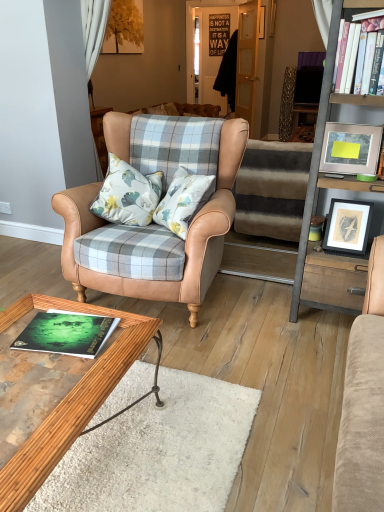
Where is `wooden framed print at right, the 1th picture frame ordered from the bottom`? The height and width of the screenshot is (512, 384). wooden framed print at right, the 1th picture frame ordered from the bottom is located at coordinates (347, 227).

Identify the location of wooden polished coffee table at lower left. (68, 398).

Describe the element at coordinates (272, 189) in the screenshot. I see `striped carpet at center` at that location.

Find the location of a particular element. This screenshot has height=512, width=384. matte white picture frame at upper right, which is the second picture frame from bottom to top is located at coordinates (350, 149).

This screenshot has width=384, height=512. Find the location of `metallic gray ladder at right`. metallic gray ladder at right is located at coordinates (317, 180).

This screenshot has width=384, height=512. In order to click on green matte book at lower left, the first book positioned from the bottom in this screenshot , I will do `click(66, 333)`.

I want to click on leather armchair at center, so click(x=186, y=238).

Locate an element on the screen. This screenshot has height=512, width=384. wooden framed print at right, the 1th picture frame ordered from the bottom is located at coordinates (347, 227).

What's the angular difference between wooden framed print at right, the 1th picture frame ordered from the bottom, and leather armchair at center's facing directions?

There is a 1.22-degree angle between the facing directions of wooden framed print at right, the 1th picture frame ordered from the bottom, and leather armchair at center.

Looking at this image, can you see wooden framed print at right, the 1th picture frame ordered from the bottom, touching leather armchair at center?

No, wooden framed print at right, the 1th picture frame ordered from the bottom, is not touching leather armchair at center.

Between wooden framed print at right, which is counted as the second picture frame, starting from the top, and leather armchair at center, which one is positioned behind?

wooden framed print at right, which is counted as the second picture frame, starting from the top, is further from the camera.

Considering the relative sizes of wooden framed print at right, the 1th picture frame ordered from the bottom, and leather armchair at center in the image provided, is wooden framed print at right, the 1th picture frame ordered from the bottom, bigger than leather armchair at center?

Actually, wooden framed print at right, the 1th picture frame ordered from the bottom, might be smaller than leather armchair at center.

Is striped carpet at center facing away from white hardcover book at upper right, the first book viewed from the right?

No, striped carpet at center is not facing the opposite direction of white hardcover book at upper right, the first book viewed from the right.

Is striped carpet at center positioned in front of white hardcover book at upper right, which is the 1th book from top to bottom?

No, striped carpet at center is further to the viewer.

From a real-world perspective, is striped carpet at center below white hardcover book at upper right, which is the 1th book from top to bottom?

Yes, from a real-world perspective, striped carpet at center is beneath white hardcover book at upper right, which is the 1th book from top to bottom.

Does green matte book at lower left, the first book positioned from the bottom, have a greater width compared to metallic gray ladder at right?

No, green matte book at lower left, the first book positioned from the bottom, is not wider than metallic gray ladder at right.

Relative to metallic gray ladder at right, is green matte book at lower left, acting as the 1th book starting from the front, in front or behind?

Visually, green matte book at lower left, acting as the 1th book starting from the front, is located in front of metallic gray ladder at right.

From a real-world perspective, does green matte book at lower left, acting as the 1th book starting from the front, sit lower than metallic gray ladder at right?

Yes, from a real-world perspective, green matte book at lower left, acting as the 1th book starting from the front, is under metallic gray ladder at right.

From the image's perspective, which is below, green matte book at lower left, the second book when ordered from top to bottom, or metallic gray ladder at right?

green matte book at lower left, the second book when ordered from top to bottom, is shown below in the image.

Which of these two, metallic gray ladder at right or wooden polished coffee table at lower left, stands taller?

metallic gray ladder at right.

Which object is positioned more to the left, metallic gray ladder at right or wooden polished coffee table at lower left?

wooden polished coffee table at lower left.

Based on the photo, which is in front, metallic gray ladder at right or wooden polished coffee table at lower left?

wooden polished coffee table at lower left.

Based on the photo, are metallic gray ladder at right and wooden polished coffee table at lower left located far from each other?

Yes, metallic gray ladder at right is far from wooden polished coffee table at lower left.

Is white hardcover book at upper right, which is the 1th book from top to bottom, not inside wooden framed print at right, the 1th picture frame ordered from the bottom?

Indeed, white hardcover book at upper right, which is the 1th book from top to bottom, is completely outside wooden framed print at right, the 1th picture frame ordered from the bottom.

Is white hardcover book at upper right, which is the 1th book from top to bottom, facing away from wooden framed print at right, the 1th picture frame ordered from the bottom?

No.

Which point is more forward, (342, 32) or (372, 207)?

The point (342, 32) is more forward.

Which object is closer to the camera taking this photo, white hardcover book at upper right, marked as the 2th book in a front-to-back arrangement, or wooden framed print at right, which is counted as the second picture frame, starting from the top?

white hardcover book at upper right, marked as the 2th book in a front-to-back arrangement, is more forward.

From a real-world perspective, who is located higher, leather armchair at center or metallic gray ladder at right?

In real-world perspective, metallic gray ladder at right is above.

In the scene shown: Is metallic gray ladder at right located within leather armchair at center?

No, leather armchair at center does not contain metallic gray ladder at right.

Which of these two, leather armchair at center or metallic gray ladder at right, is smaller?

Smaller between the two is metallic gray ladder at right.

Is leather armchair at center oriented towards metallic gray ladder at right?

No, leather armchair at center does not turn towards metallic gray ladder at right.

Looking at this image, are striped carpet at center and green matte book at lower left, acting as the 1th book starting from the front, far apart?

Yes, striped carpet at center and green matte book at lower left, acting as the 1th book starting from the front, are located far from each other.

From the picture: Is striped carpet at center inside or outside of green matte book at lower left, which is the second book from back to front?

striped carpet at center exists outside the volume of green matte book at lower left, which is the second book from back to front.

From the image's perspective, is striped carpet at center below green matte book at lower left, the 2th book when ordered from right to left?

No.

From the picture: Which object is thinner, striped carpet at center or green matte book at lower left, acting as the 1th book starting from the front?

green matte book at lower left, acting as the 1th book starting from the front, is thinner.

At what (x,y) coordinates should I click in order to perform the action: click on picture frame located below the leather armchair at center (from the image's perspective). Please return your answer as a coordinate pair (x, y). Image resolution: width=384 pixels, height=512 pixels. Looking at the image, I should click on (347, 227).

Identify the location of book above the striped carpet at center (from the image's perspective). (353, 47).

Considering their positions, is metallic gray ladder at right positioned closer to white hardcover book at upper right, which is the 1th book from top to bottom, than striped carpet at center?

The object closer to white hardcover book at upper right, which is the 1th book from top to bottom, is metallic gray ladder at right.

From the image, which object appears to be farther from matte white picture frame at upper right, placed as the 1th picture frame when sorted from top to bottom, striped carpet at center or metallic gray ladder at right?

striped carpet at center is positioned further to the anchor matte white picture frame at upper right, placed as the 1th picture frame when sorted from top to bottom.

Which object lies nearer to the anchor point matte white picture frame at upper right, which is the second picture frame from bottom to top, leather armchair at center or wooden polished coffee table at lower left?

leather armchair at center is closer to matte white picture frame at upper right, which is the second picture frame from bottom to top.

From the picture: Considering their positions, is metallic gray ladder at right positioned closer to matte white picture frame at upper right, which is the second picture frame from bottom to top, than striped carpet at center?

Based on the image, metallic gray ladder at right appears to be nearer to matte white picture frame at upper right, which is the second picture frame from bottom to top.

Looking at this image, when comparing their distances from leather armchair at center, does wooden polished coffee table at lower left or green matte book at lower left, the first book positioned from the bottom, seem closer?

The object closer to leather armchair at center is green matte book at lower left, the first book positioned from the bottom.

Estimate the real-world distances between objects in this image. Which object is further from leather armchair at center, wooden polished coffee table at lower left or wooden framed print at right, the 1th picture frame ordered from the bottom?

wooden polished coffee table at lower left.

From the image, which object appears to be farther from metallic gray ladder at right, green matte book at lower left, the 2th book when ordered from right to left, or leather armchair at center?

Among the two, green matte book at lower left, the 2th book when ordered from right to left, is located further to metallic gray ladder at right.

Looking at the image, which one is located closer to metallic gray ladder at right, striped carpet at center or leather armchair at center?

Among the two, leather armchair at center is located nearer to metallic gray ladder at right.

Locate an element on the screen. Image resolution: width=384 pixels, height=512 pixels. picture frame between green matte book at lower left, the 2th book when ordered from right to left, and white hardcover book at upper right, acting as the first book starting from the back, from left to right is located at coordinates (350, 149).

This screenshot has width=384, height=512. I want to click on chair between metallic gray ladder at right and striped carpet at center from front to back, so click(186, 238).

I want to click on chair between wooden polished coffee table at lower left and metallic gray ladder at right in the horizontal direction, so click(186, 238).

The image size is (384, 512). I want to click on book between wooden polished coffee table at lower left and matte white picture frame at upper right, placed as the 1th picture frame when sorted from top to bottom, so click(x=66, y=333).